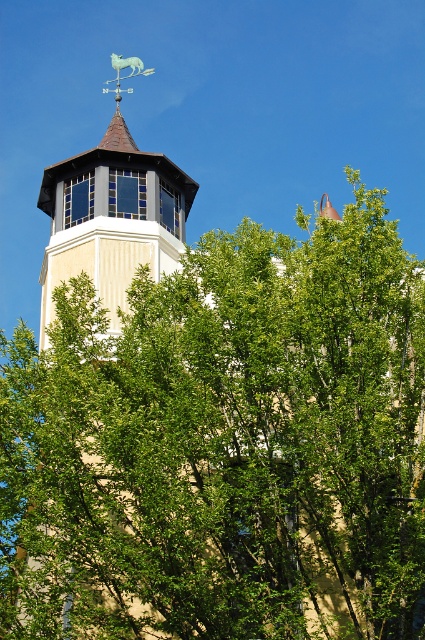
You are standing in front of the building and notice the green leafy tree at center and the metallic blue horse at upper center. Which object is taller?

The green leafy tree at center is taller than the metallic blue horse at upper center.

You are standing in front of the building and notice the green leafy tree at center and the metallic blue horse at upper center. Which object takes up more horizontal space in the image?

The green leafy tree at center takes up more horizontal space because its width is larger than that of the metallic blue horse at upper center.